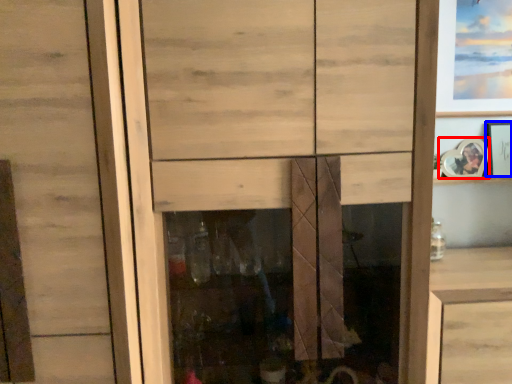
Question: Which point is further to the camera, picture frame (highlighted by a red box) or picture frame (highlighted by a blue box)?

Choices:
 (A) picture frame
 (B) picture frame

Answer: (B)